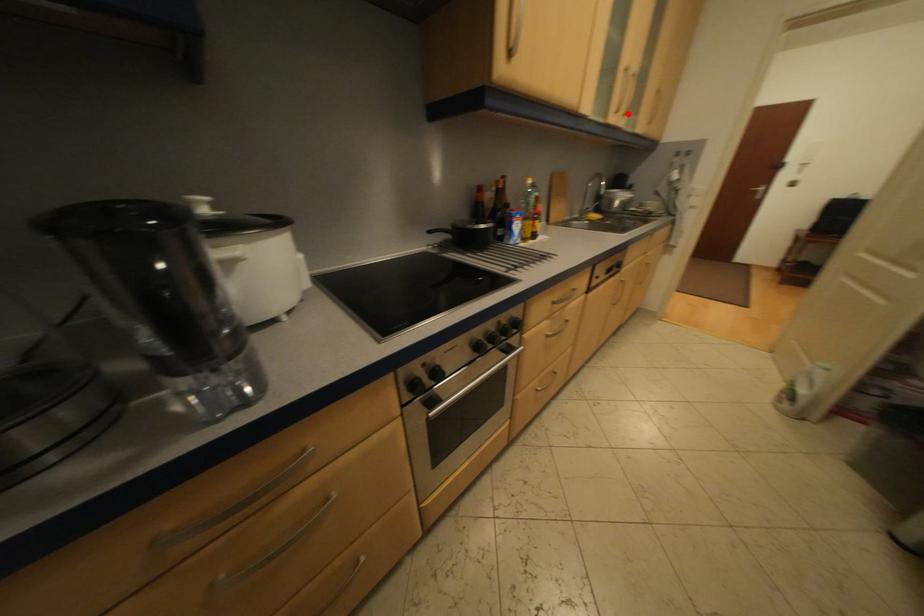
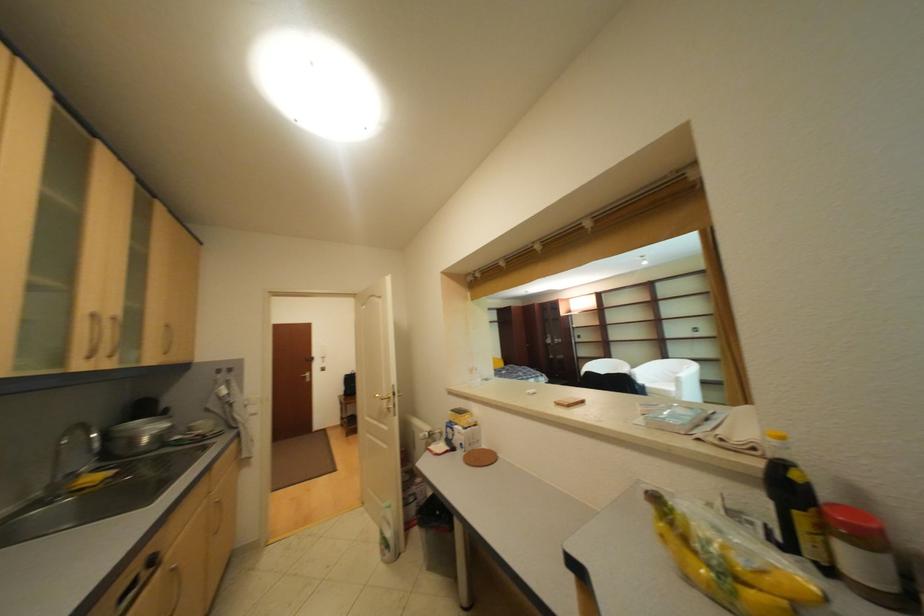
Where in the second image is the point corresponding to the highlighted location from the first image?

(101, 359)